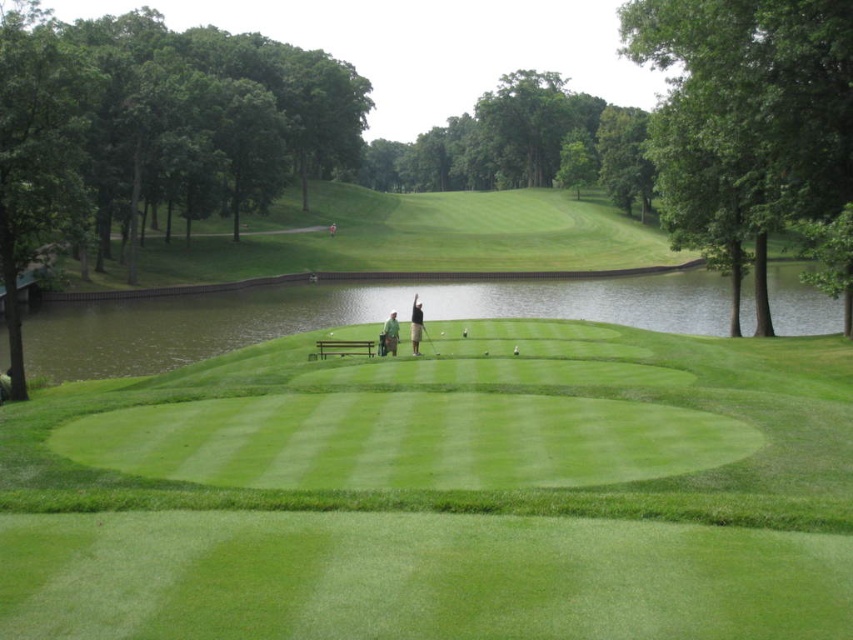
Between point (392, 321) and point (416, 336), which one is positioned in front?

Point (416, 336) is in front.

Can you confirm if green fabric shirt at center is positioned to the right of dark gray pants at center?

No, green fabric shirt at center is not to the right of dark gray pants at center.

The image size is (853, 640). What are the coordinates of `green fabric shirt at center` in the screenshot? It's located at tap(390, 333).

Does green fabric shirt at center appear under metallic silver golf club at center?

Yes, green fabric shirt at center is below metallic silver golf club at center.

Is green fabric shirt at center taller than metallic silver golf club at center?

No, green fabric shirt at center is not taller than metallic silver golf club at center.

Who is more distant from viewer, (387, 342) or (426, 336)?

The point (426, 336) is behind.

You are a GUI agent. You are given a task and a screenshot of the screen. Output one action in this format:
    pyautogui.click(x=<x>, y=<y>)
    Task: Click on the green fabric shirt at center
    The width and height of the screenshot is (853, 640).
    Given the screenshot: What is the action you would take?
    pyautogui.click(x=390, y=333)

Looking at this image, is green smooth grass at center further to the viewer compared to green water at center?

No, it is not.

Is green smooth grass at center bigger than green water at center?

Incorrect, green smooth grass at center is not larger than green water at center.

Who is more forward, [271,529] or [253,321]?

Positioned in front is point [271,529].

This screenshot has width=853, height=640. I want to click on green smooth grass at center, so click(x=440, y=492).